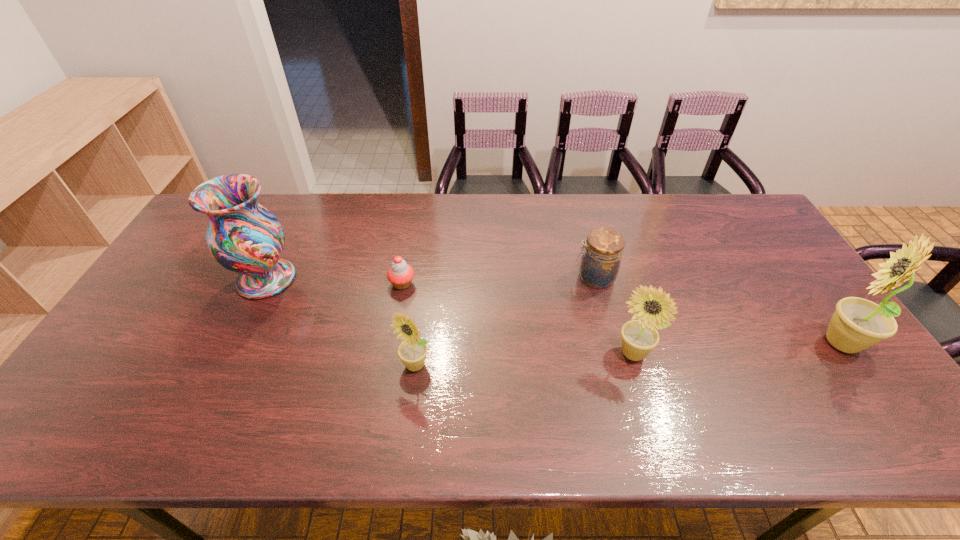
Locate an element on the screen. This screenshot has width=960, height=540. the leftmost sunflower is located at coordinates (412, 351).

The image size is (960, 540). Identify the location of the shortest sunflower. [412, 351].

The height and width of the screenshot is (540, 960). Find the location of `the second tallest sunflower`. the second tallest sunflower is located at coordinates (652, 308).

Where is `the fourth shortest object`? The width and height of the screenshot is (960, 540). the fourth shortest object is located at coordinates [x=652, y=308].

At what (x,y) coordinates should I click in order to perform the action: click on the rightmost object. Please return your answer as a coordinate pair (x, y). Image resolution: width=960 pixels, height=540 pixels. Looking at the image, I should click on (857, 324).

The width and height of the screenshot is (960, 540). Find the location of `the tallest sunflower`. the tallest sunflower is located at coordinates (857, 324).

What are the coordinates of `the shortest object` in the screenshot? It's located at (400, 274).

This screenshot has width=960, height=540. Find the location of `vase`. vase is located at coordinates (244, 237).

I want to click on the second shortest object, so click(600, 263).

Identify the location of vacant space located 0.090m on the face of the second tallest sunflower. (646, 402).